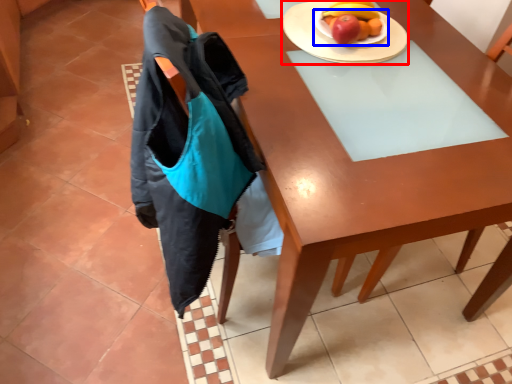
Question: Which object is closer to the camera taking this photo, plate (highlighted by a red box) or plate (highlighted by a blue box)?

Choices:
 (A) plate
 (B) plate

Answer: (A)